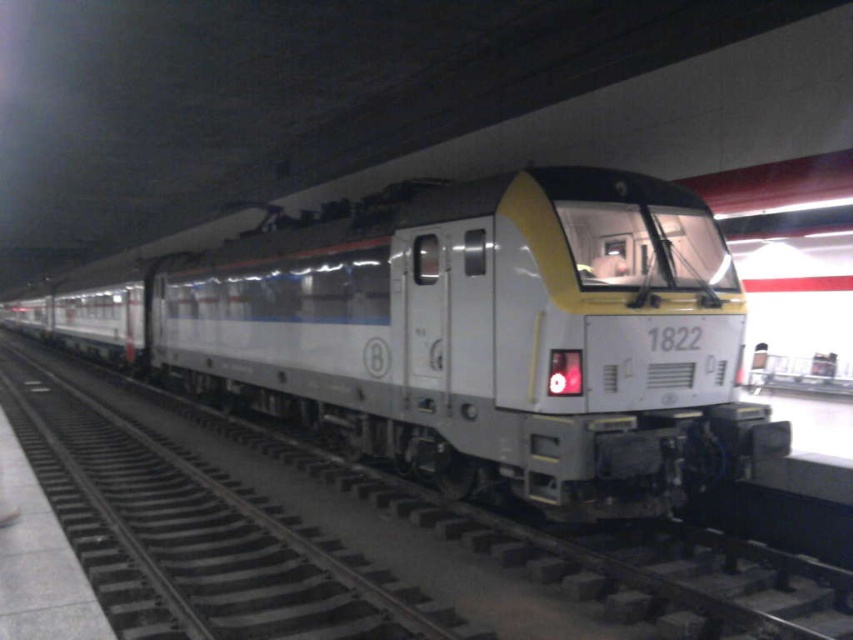
In the scene shown: You are a maintenance worker at the train station. You need to check the space between the silver metallic train at center and the metallic track at center. Can you fit a 1.2 meter wide equipment cart between them?

The silver metallic train at center is thinner than the metallic track at center. Therefore, the space between them is sufficient to accommodate a 1.2 meter wide equipment cart.

You are standing at the entrance of the train station. You want to board the silver metallic train at center. Which direction should you walk to reach it?

Walk straight ahead towards the silver metallic train at center located at point [467,337].